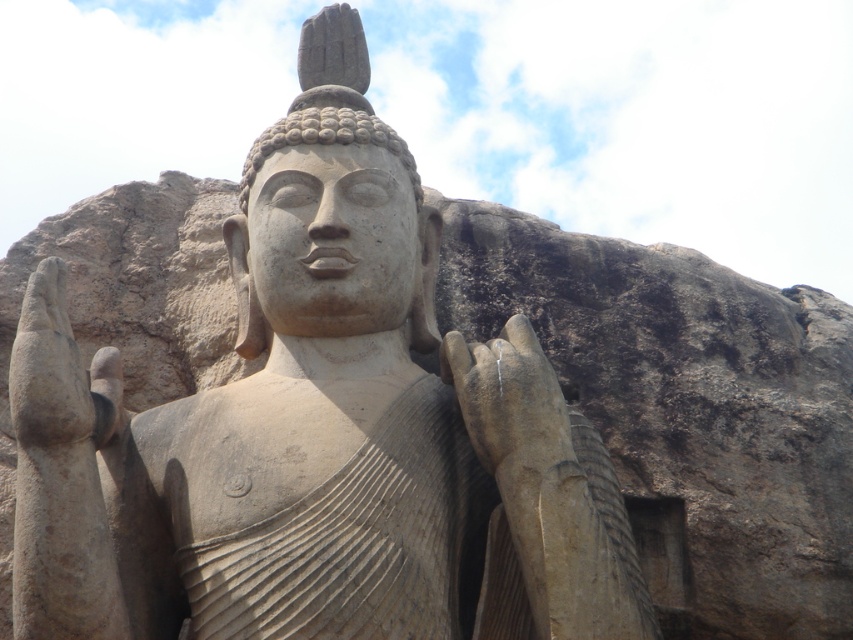
You are an art conservator examining the Buddha sculpture. You notice two hands on the statue, the smooth stone hand at center and the matte stone hand at left. Which hand appears nearer to you when observing the sculpture?

The smooth stone hand at center is closer to the viewer than the matte stone hand at left.

Looking at the statue of Buddha in the image, which hand is positioned to the right of the other? Specifically, is the smooth stone hand at center located to the right or left of the matte stone hand at left?

The smooth stone hand at center is to the right of the matte stone hand at left.

You are an art conservator examining the Buddha sculpture. You need to place a protective cover over both the smooth stone hand at center and the matte stone hand at left. Which hand requires a wider cover?

The matte stone hand at left requires a wider cover because its width is greater than the smooth stone hand at center.